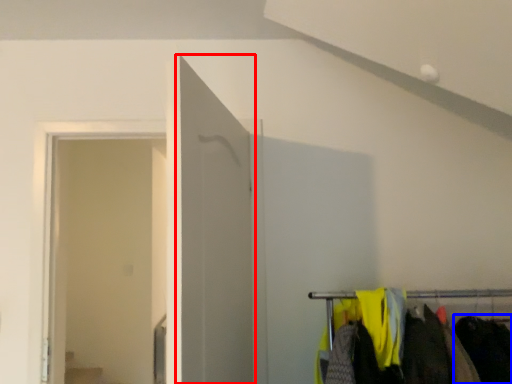
Question: Which object is further to the camera taking this photo, door (highlighted by a red box) or clothing (highlighted by a blue box)?

Choices:
 (A) door
 (B) clothing

Answer: (B)